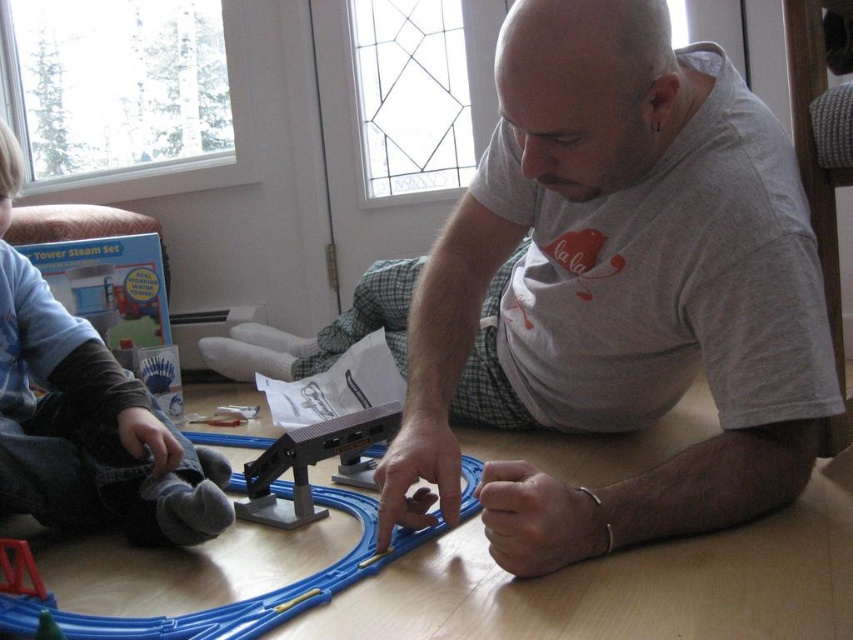
In the scene shown: Can you confirm if matte gray shirt at center is smaller than light blue denim jeans at lower left?

No.

Does matte gray shirt at center have a lesser height compared to light blue denim jeans at lower left?

Incorrect, matte gray shirt at center's height does not fall short of light blue denim jeans at lower left's.

Where is `matte gray shirt at center`? The height and width of the screenshot is (640, 853). matte gray shirt at center is located at coordinates (612, 292).

You are a GUI agent. You are given a task and a screenshot of the screen. Output one action in this format:
    pyautogui.click(x=<x>, y=<y>)
    Task: Click on the matte gray shirt at center
    
    Given the screenshot: What is the action you would take?
    (x=612, y=292)

Is matte gray shirt at center shorter than blue plastic track at center?

Incorrect, matte gray shirt at center's height does not fall short of blue plastic track at center's.

Which is in front, point (714, 499) or point (361, 524)?

Positioned in front is point (714, 499).

Is point (685, 189) positioned before point (282, 483)?

Yes, point (685, 189) is in front of point (282, 483).

The image size is (853, 640). I want to click on matte gray shirt at center, so click(x=612, y=292).

Can you confirm if light blue denim jeans at lower left is bigger than blue plastic track at center?

No, light blue denim jeans at lower left is not bigger than blue plastic track at center.

Does light blue denim jeans at lower left have a greater width compared to blue plastic track at center?

In fact, light blue denim jeans at lower left might be narrower than blue plastic track at center.

Who is more forward, (106, 442) or (310, 493)?

Point (310, 493) is more forward.

What are the coordinates of `light blue denim jeans at lower left` in the screenshot? It's located at (86, 419).